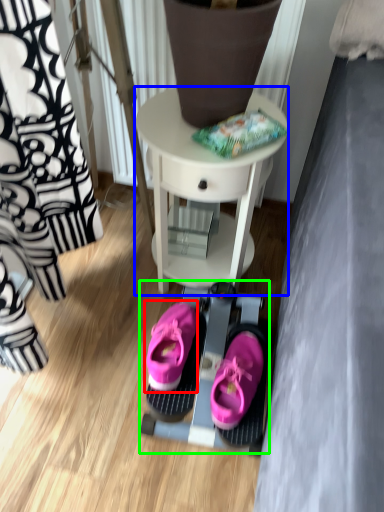
Question: Based on their relative distances, which object is nearer to footwear (highlighted by a red box)? Choose from table (highlighted by a blue box) and bunk bed (highlighted by a green box).

Choices:
 (A) table
 (B) bunk bed

Answer: (B)